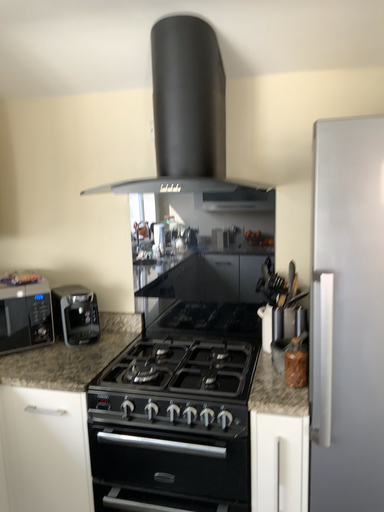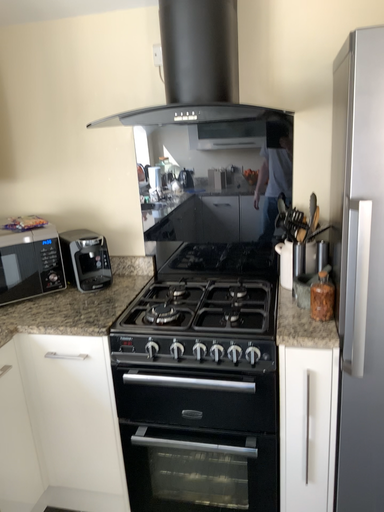
Question: How did the camera likely rotate when shooting the video?

Choices:
 (A) rotated upward
 (B) rotated downward

Answer: (B)